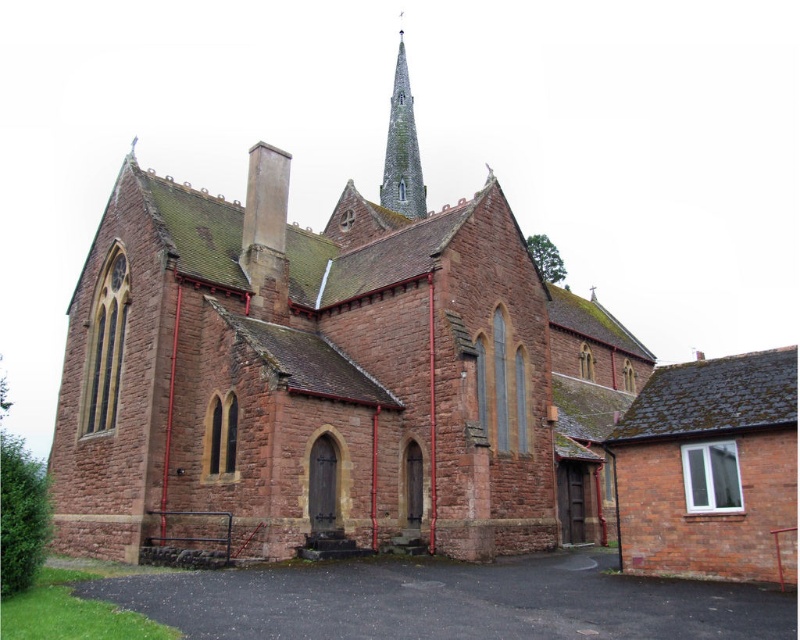
Does brown stone chapel at center come in front of gray stone spire at upper center?

Yes, it is in front of gray stone spire at upper center.

Who is taller, brown stone chapel at center or gray stone spire at upper center?

gray stone spire at upper center

Is point (66, 481) positioned before point (420, 209)?

That is True.

This screenshot has height=640, width=800. I want to click on brown stone chapel at center, so click(x=328, y=380).